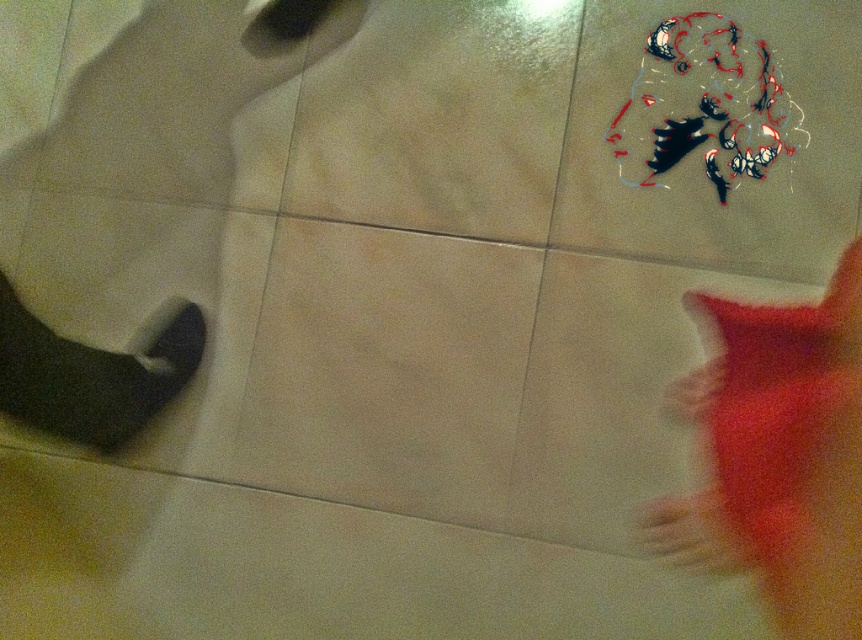
Which is behind, point (370, 160) or point (67, 416)?

The point (370, 160) is more distant.

Is point (344, 216) more distant than point (173, 339)?

Yes, point (344, 216) is behind point (173, 339).

You are a GUI agent. You are given a task and a screenshot of the screen. Output one action in this format:
    pyautogui.click(x=<x>, y=<y>)
    Task: Click on the matte beige tile at center
    This screenshot has height=640, width=862.
    Given the screenshot: What is the action you would take?
    pyautogui.click(x=438, y=120)

Which of these two, red fluffy cat at lower right or fluffy orange cat at upper right, stands taller?

With more height is red fluffy cat at lower right.

Find the location of a particular element. red fluffy cat at lower right is located at coordinates (611, 392).

Which is behind, point (359, 240) or point (628, 234)?

The point (359, 240) is behind.

Is beige matte tile at center smaller than painted portrait at center?

Actually, beige matte tile at center might be larger than painted portrait at center.

Who is more distant from viewer, (363,339) or (854,218)?

Point (363,339)

This screenshot has height=640, width=862. In order to click on beige matte tile at center in this screenshot , I will do `click(388, 369)`.